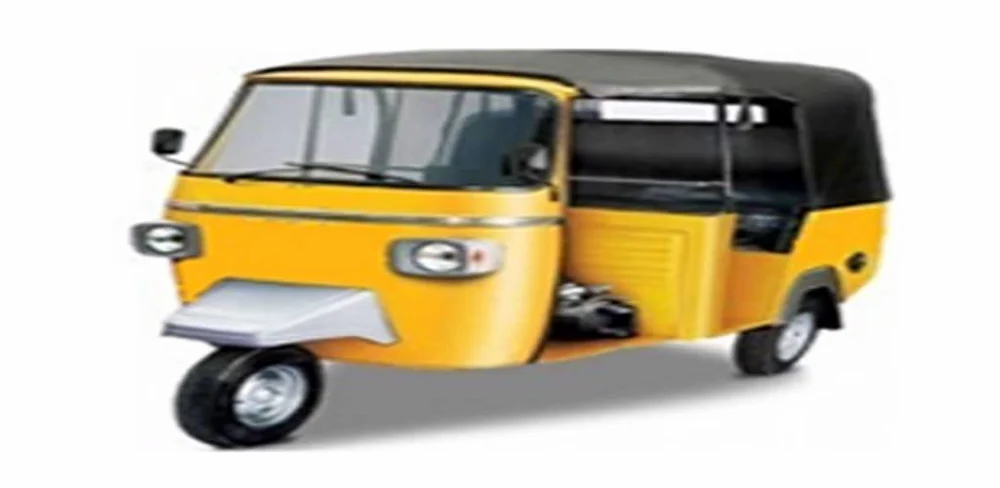
Identify the location of window. The height and width of the screenshot is (488, 1000). (466, 163).